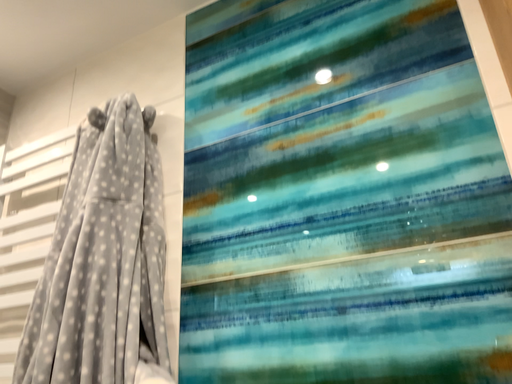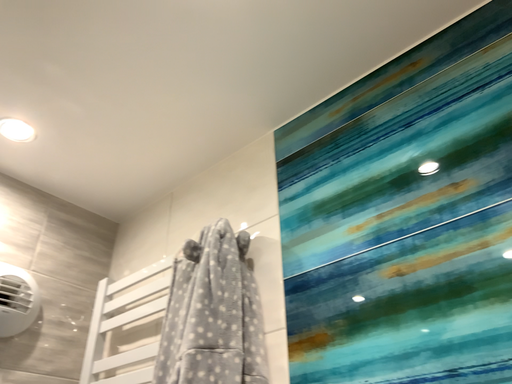
Question: How did the camera likely rotate when shooting the video?

Choices:
 (A) rotated right
 (B) rotated left

Answer: (B)